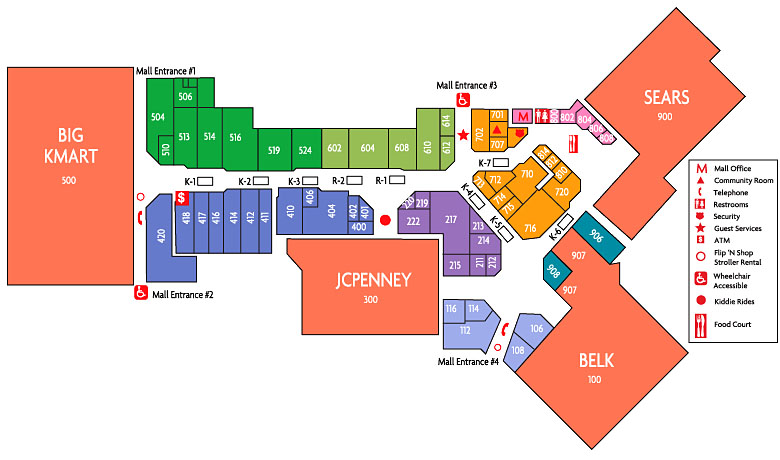
At what (x,y) coordinates should I click in order to perform the action: click on purple room. Please return your answer as a coordinate pair (x, y). The image size is (780, 460). Looking at the image, I should click on (491, 266), (477, 270), (459, 265), (474, 246), (474, 224), (456, 226), (410, 224), (422, 199), (406, 202).